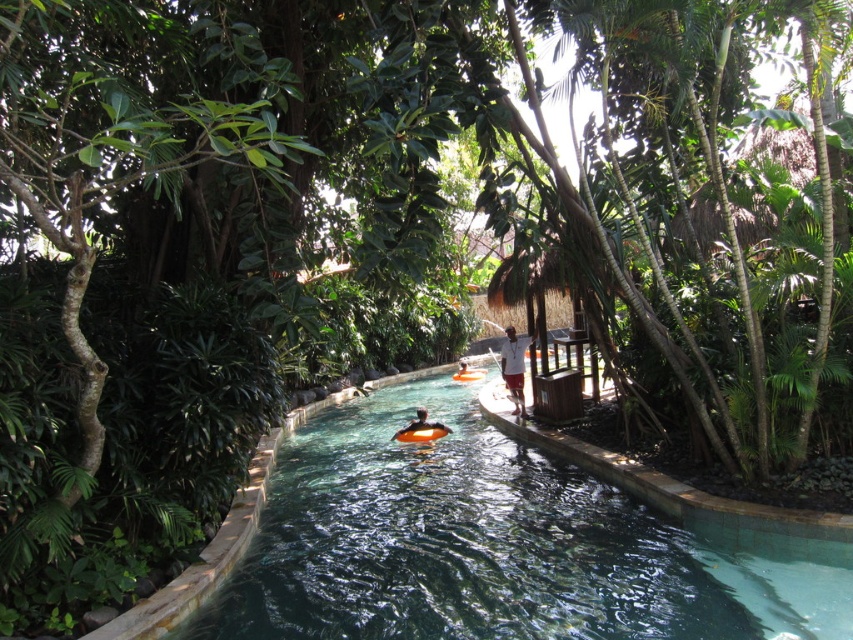
Where is `clear blue water at center`? Image resolution: width=853 pixels, height=640 pixels. clear blue water at center is located at coordinates pos(496,547).

Is clear blue water at center positioned in front of orange foam ring at center?

Yes, it is.

Locate an element on the screen. This screenshot has height=640, width=853. clear blue water at center is located at coordinates (496, 547).

Can you confirm if clear blue water at center is wider than white matte shorts at center?

Correct, the width of clear blue water at center exceeds that of white matte shorts at center.

Is clear blue water at center bigger than white matte shorts at center?

Correct, clear blue water at center is larger in size than white matte shorts at center.

Based on the photo, who is more distant from viewer, (590, 564) or (512, 378)?

The point (512, 378) is more distant.

At what (x,y) coordinates should I click in order to perform the action: click on clear blue water at center. Please return your answer as a coordinate pair (x, y). This screenshot has height=640, width=853. Looking at the image, I should click on (496, 547).

Can you confirm if white matte shorts at center is shorter than orange foam ring at center?

No.

Who is positioned more to the left, white matte shorts at center or orange foam ring at center?

Positioned to the left is orange foam ring at center.

Find the location of `white matte shorts at center`. white matte shorts at center is located at coordinates (514, 368).

At what (x,y) coordinates should I click in order to perform the action: click on white matte shorts at center. Please return your answer as a coordinate pair (x, y). Looking at the image, I should click on (514, 368).